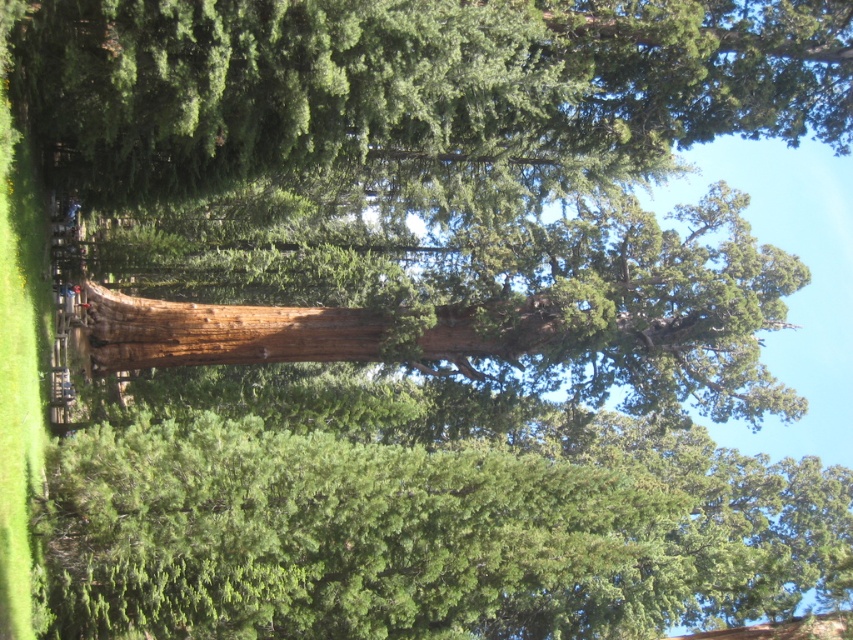
Question: Which point is closer to the camera?

Choices:
 (A) brown rough log at center
 (B) green rough bark tree at center
 (C) smooth brown tree trunk at center

Answer: (B)

Question: Which object is closer to the camera taking this photo?

Choices:
 (A) green rough bark tree at center
 (B) smooth brown tree trunk at center

Answer: (A)

Question: Is green rough bark tree at center above smooth brown tree trunk at center?

Choices:
 (A) yes
 (B) no

Answer: (B)

Question: In this image, where is smooth brown tree trunk at center located relative to brown rough log at center?

Choices:
 (A) left
 (B) right

Answer: (B)

Question: Based on their relative distances, which object is nearer to the brown rough log at center?

Choices:
 (A) smooth brown tree trunk at center
 (B) green rough bark tree at center

Answer: (A)

Question: From the image, what is the correct spatial relationship of green rough bark tree at center in relation to brown rough log at center?

Choices:
 (A) below
 (B) above

Answer: (A)